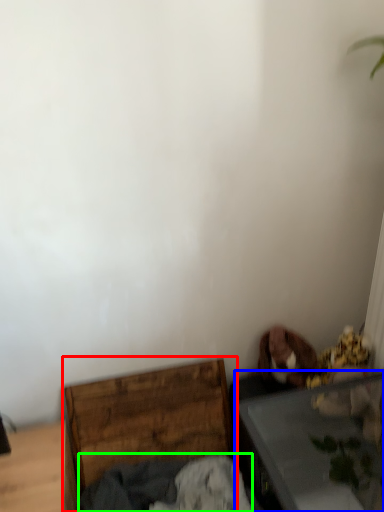
Question: Which object is positioned closest to furniture (highlighted by a red box)? Select from table (highlighted by a blue box) and clothing (highlighted by a green box).

Choices:
 (A) table
 (B) clothing

Answer: (B)